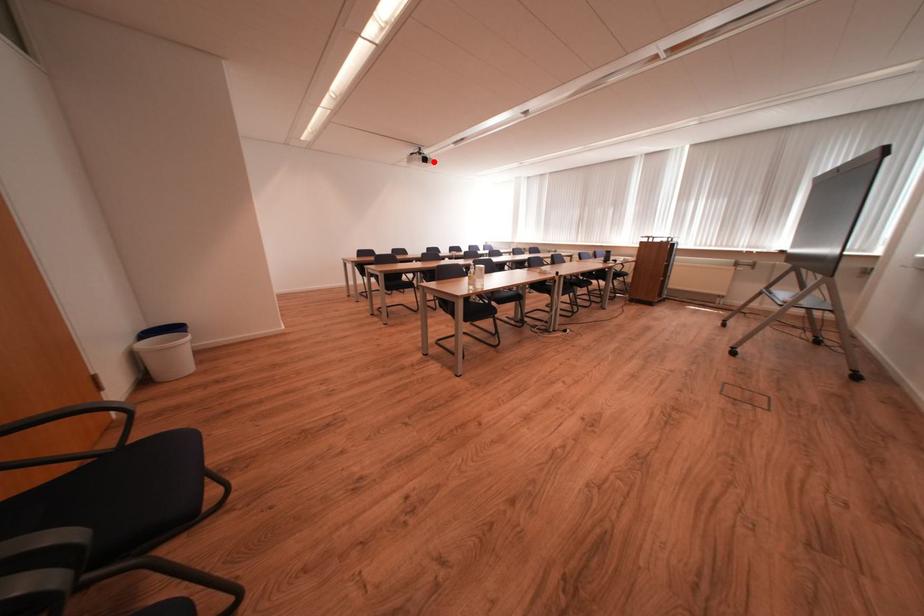
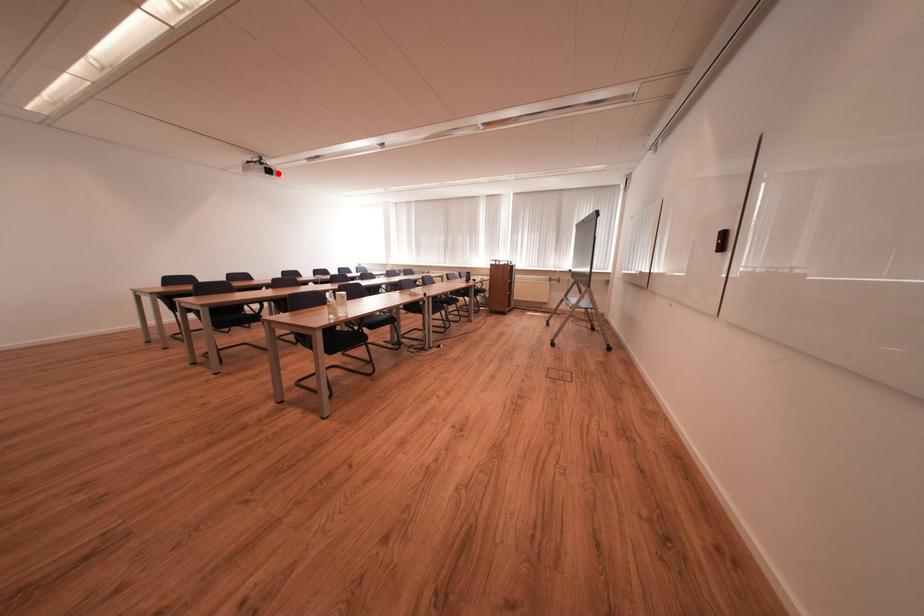
I am providing you with two images of the same scene from different viewpoints. A red point is marked on the first image and another point is marked on the second image. Is the red point in image1 aligned with the point shown in image2?

Yes